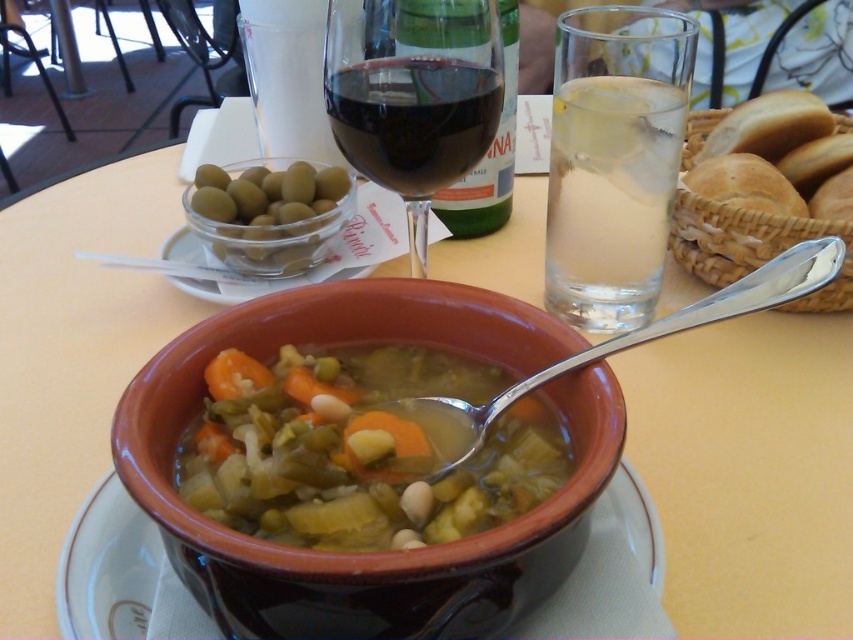
You are a server at the restaurant and need to place a new order of utensils on the table. The new spoon is exactly the same size as the silver metallic spoon at center. Can you fit it next to the transparent glass wine glass at center without overlapping?

The transparent glass wine glass at center is thinner than the silver metallic spoon at center. Since the new spoon is the same size as the existing spoon, it would be wider than the wine glass. Therefore, there should be enough space to place the new spoon next to the transparent glass wine glass at center without overlapping.

You are a waiter holding a tray and need to place a new drink order at the table. The drink must be placed so it is exactly 4 inches away from the silver metallic spoon at center. Can you place the clear glass water at upper right in the correct position?

Yes, the clear glass water at upper right is already positioned exactly 4.05 inches away from the silver metallic spoon at center, which meets the requirement of being 4 inches away.

Consider the image. You are a waiter at a restaurant and need to place a napkin between the transparent glass wine glass at center and the silver metallic spoon at center. Which object should you place the napkin closer to if you want it to be on the right side of the wine glass?

Result: You should place the napkin closer to the silver metallic spoon at center because the transparent glass wine glass at center is to the left of the silver metallic spoon at center.